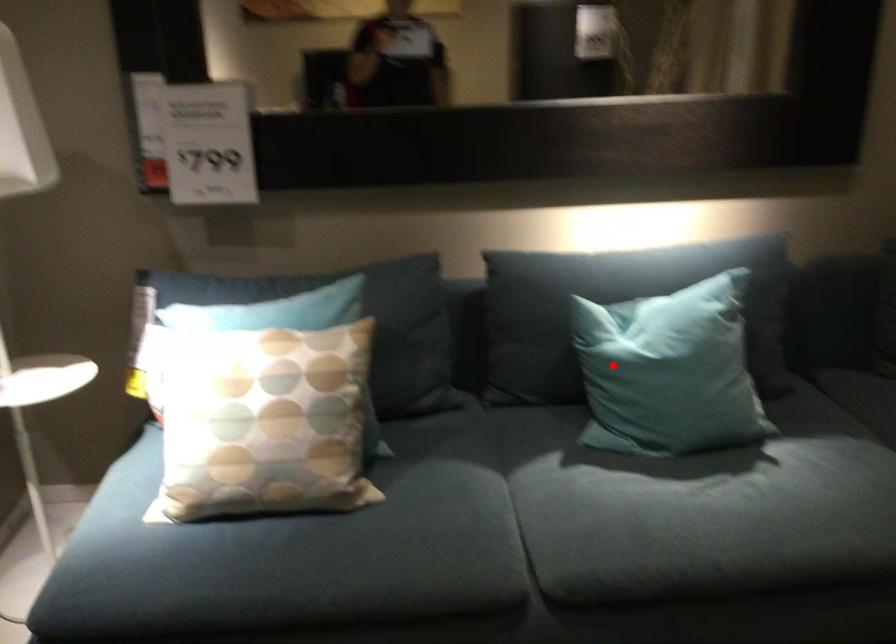
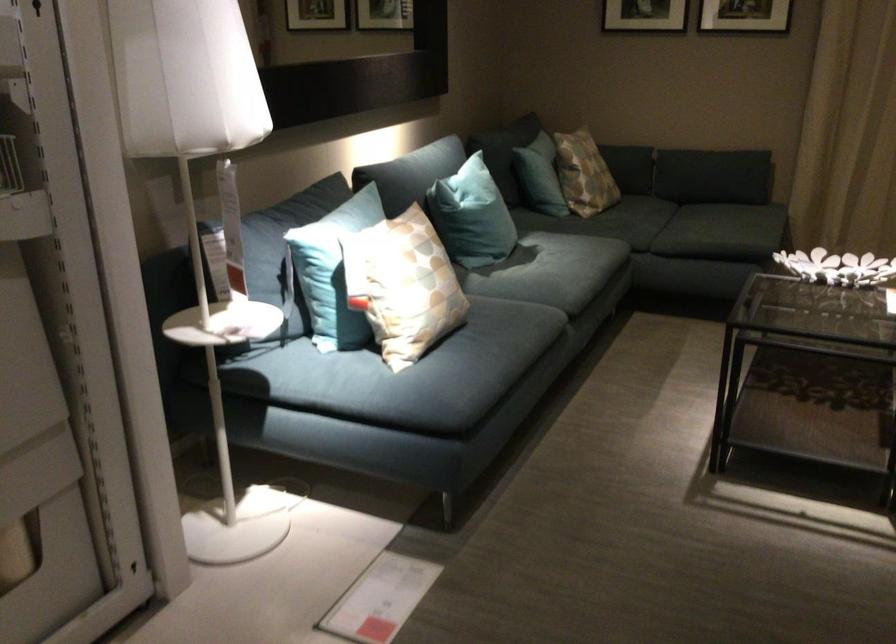
Question: I am providing you with two images of the same scene from different viewpoints. A red point is marked on the first image. At the location where the point appears in image 1, is it still visible in image 2?

Choices:
 (A) Yes
 (B) No

Answer: (A)